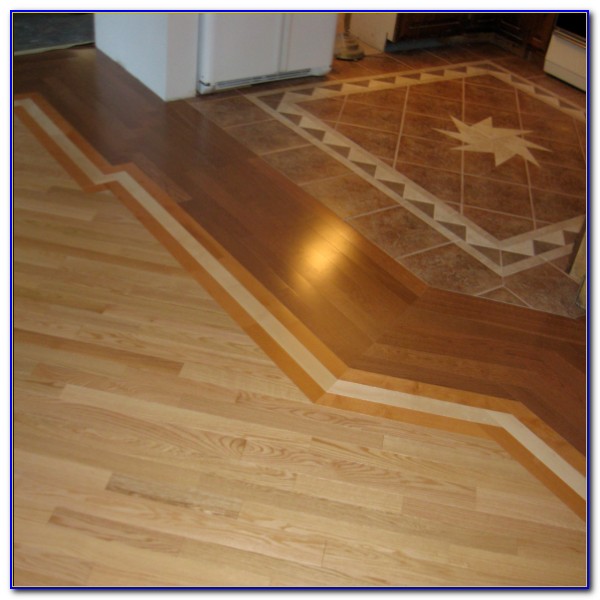
Where is `corner of square design on floor`? The image size is (600, 600). corner of square design on floor is located at coordinates (277, 97), (500, 259), (485, 65).